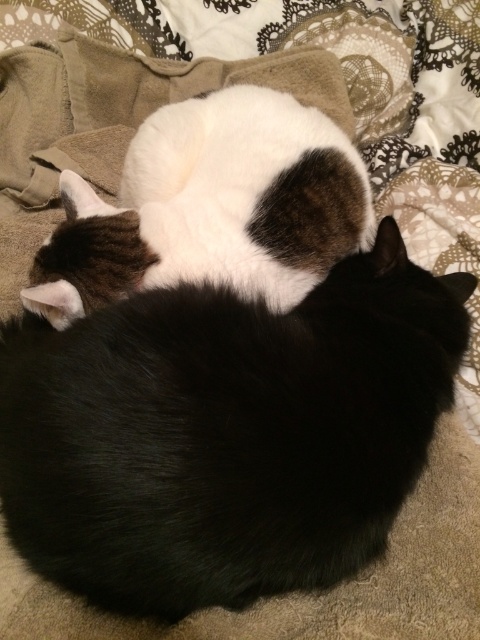
Can you confirm if black fur cat at center is bigger than white fur cat at center?

Yes.

Between black fur cat at center and white fur cat at center, which one has less height?

With less height is white fur cat at center.

Which is behind, point (178, 476) or point (251, 253)?

The point (251, 253) is behind.

I want to click on black fur cat at center, so click(x=226, y=433).